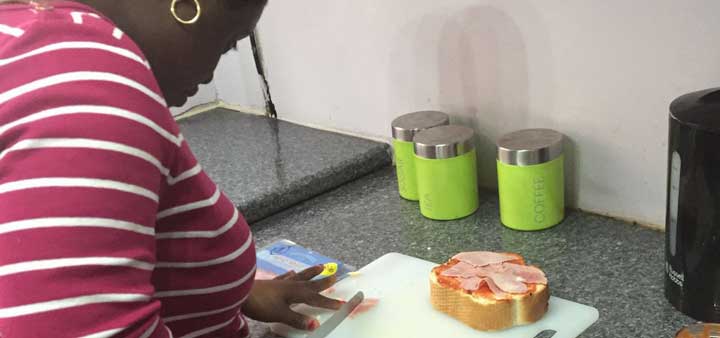
You are a GUI agent. You are given a task and a screenshot of the screen. Output one action in this format:
    pyautogui.click(x=<x>, y=<y>)
    Task: Click on the black coffee maker
    The height and width of the screenshot is (338, 720).
    Given the screenshot: What is the action you would take?
    pyautogui.click(x=708, y=206)